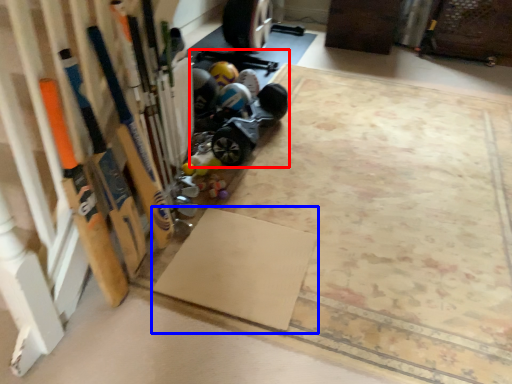
Question: Which object is closer to the camera taking this photo, car (highlighted by a red box) or yoga mat (highlighted by a blue box)?

Choices:
 (A) car
 (B) yoga mat

Answer: (B)